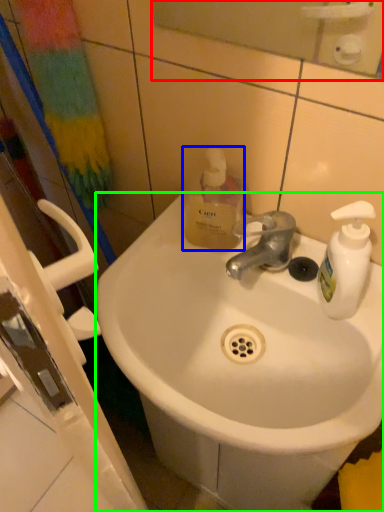
Question: Estimate the real-world distances between objects in this image. Which object is closer to mirror (highlighted by a red box), bottle (highlighted by a blue box) or sink (highlighted by a green box)?

Choices:
 (A) bottle
 (B) sink

Answer: (A)